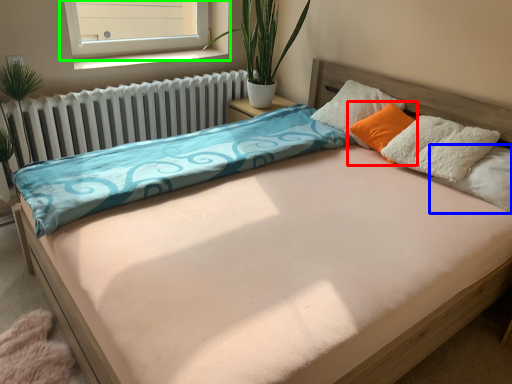
Question: Considering the real-world distances, which object is closest to pillow (highlighted by a red box)? pillow (highlighted by a blue box) or window (highlighted by a green box).

Choices:
 (A) pillow
 (B) window

Answer: (A)